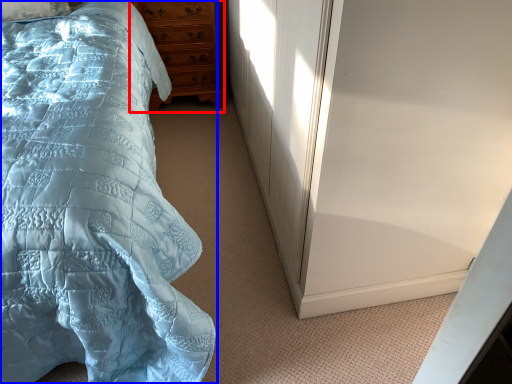
Question: Which object appears closest to the camera in this image, chest of drawers (highlighted by a red box) or bed (highlighted by a blue box)?

Choices:
 (A) chest of drawers
 (B) bed

Answer: (B)